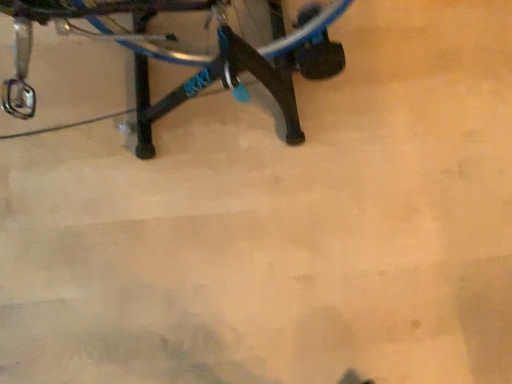
Identify the location of vacant region in front of black matte bicycle at center. The width and height of the screenshot is (512, 384). tap(129, 262).